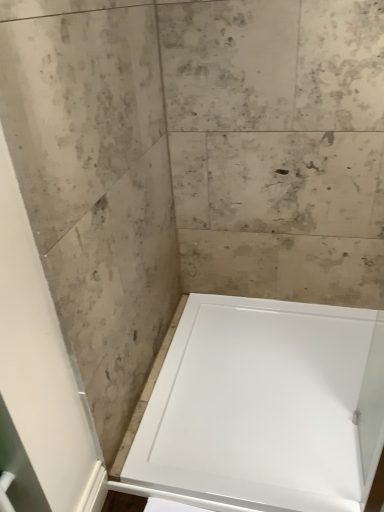
This screenshot has height=512, width=384. What are the coordinates of `free spot above white glossy bathtub at center (from a real-world perspective)` in the screenshot? It's located at (272, 387).